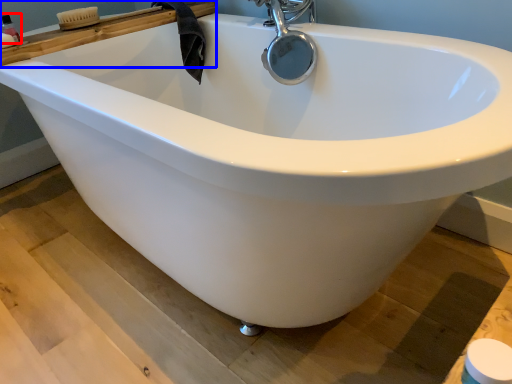
Question: Which object appears farthest to the camera in this image, toiletry (highlighted by a red box) or ledge (highlighted by a blue box)?

Choices:
 (A) toiletry
 (B) ledge

Answer: (A)